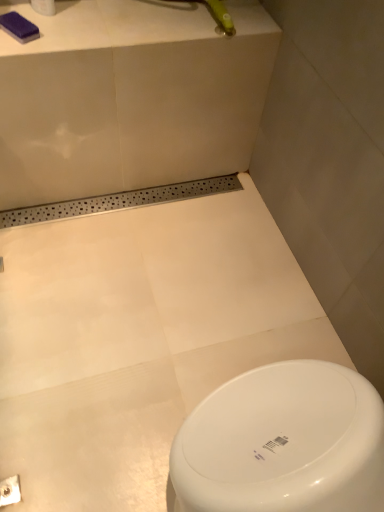
Question: Can you confirm if white glossy bath at lower center is shorter than white matte toilet paper at upper left?

Choices:
 (A) no
 (B) yes

Answer: (A)

Question: Is white glossy bath at lower center wider than white matte toilet paper at upper left?

Choices:
 (A) no
 (B) yes

Answer: (B)

Question: Can you confirm if white glossy bath at lower center is bigger than white matte toilet paper at upper left?

Choices:
 (A) no
 (B) yes

Answer: (B)

Question: Is white glossy bath at lower center turned away from white matte toilet paper at upper left?

Choices:
 (A) yes
 (B) no

Answer: (B)

Question: From the image's perspective, is white glossy bath at lower center located above white matte toilet paper at upper left?

Choices:
 (A) yes
 (B) no

Answer: (B)

Question: Is white glossy bath at lower center taller than white matte toilet paper at upper left?

Choices:
 (A) no
 (B) yes

Answer: (B)

Question: Is white matte toilet paper at upper left not near white glossy bath at lower center?

Choices:
 (A) yes
 (B) no

Answer: (B)

Question: From the image's perspective, is white matte toilet paper at upper left beneath white glossy bath at lower center?

Choices:
 (A) no
 (B) yes

Answer: (A)

Question: Considering the relative sizes of white matte toilet paper at upper left and white glossy bath at lower center in the image provided, is white matte toilet paper at upper left thinner than white glossy bath at lower center?

Choices:
 (A) yes
 (B) no

Answer: (A)

Question: Can you confirm if white matte toilet paper at upper left is taller than white glossy bath at lower center?

Choices:
 (A) no
 (B) yes

Answer: (A)

Question: Considering the relative positions of white matte toilet paper at upper left and white glossy bath at lower center in the image provided, is white matte toilet paper at upper left to the right of white glossy bath at lower center from the viewer's perspective?

Choices:
 (A) no
 (B) yes

Answer: (A)

Question: From a real-world perspective, is white matte toilet paper at upper left physically below white glossy bath at lower center?

Choices:
 (A) no
 (B) yes

Answer: (A)

Question: Considering the relative positions of white matte toilet paper at upper left and white glossy bath at lower center in the image provided, is white matte toilet paper at upper left to the left or to the right of white glossy bath at lower center?

Choices:
 (A) left
 (B) right

Answer: (A)